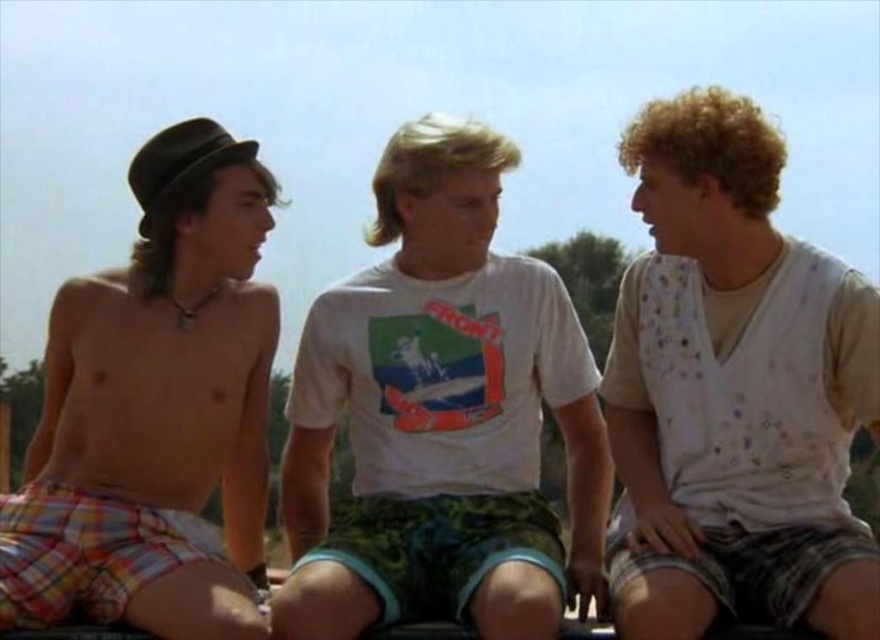
Is white cotton t-shirt at center to the left of white dotted shirt at right from the viewer's perspective?

Indeed, white cotton t-shirt at center is positioned on the left side of white dotted shirt at right.

Is point (455, 525) in front of point (690, 337)?

No, it is behind (690, 337).

Which is behind, point (546, 612) or point (826, 380)?

Point (826, 380)

I want to click on white cotton t-shirt at center, so click(x=441, y=416).

Which is more to the right, white cotton t-shirt at center or plaid shorts at left?

Positioned to the right is white cotton t-shirt at center.

What are the coordinates of `white cotton t-shirt at center` in the screenshot? It's located at (441, 416).

The height and width of the screenshot is (640, 880). Find the location of `white cotton t-shirt at center`. white cotton t-shirt at center is located at coordinates (441, 416).

Is white dotted shirt at right positioned before plaid shorts at left?

Yes, white dotted shirt at right is in front of plaid shorts at left.

Does point (753, 120) come in front of point (184, 250)?

Yes, point (753, 120) is in front of point (184, 250).

What are the coordinates of `white dotted shirt at right` in the screenshot? It's located at (732, 388).

Where is `white dotted shirt at right`? The image size is (880, 640). white dotted shirt at right is located at coordinates (732, 388).